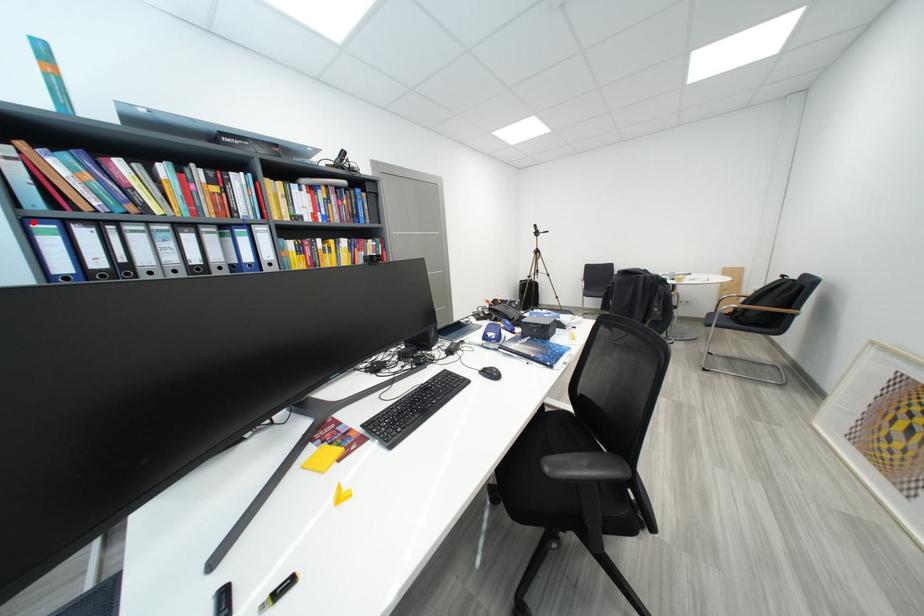
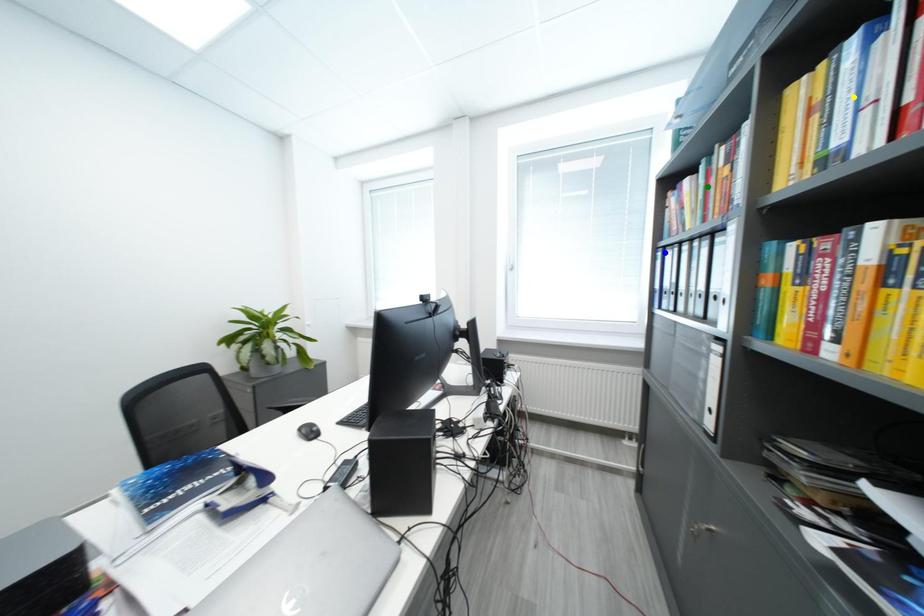
Question: I am providing you with two images of the same scene from different viewpoints. A red point is marked on the first image. You are given multiple points on the second image. Can you choose the point in image 2 that corresponds to the point in image 1?

Choices:
 (A) green point
 (B) yellow point
 (C) blue point

Answer: (C)